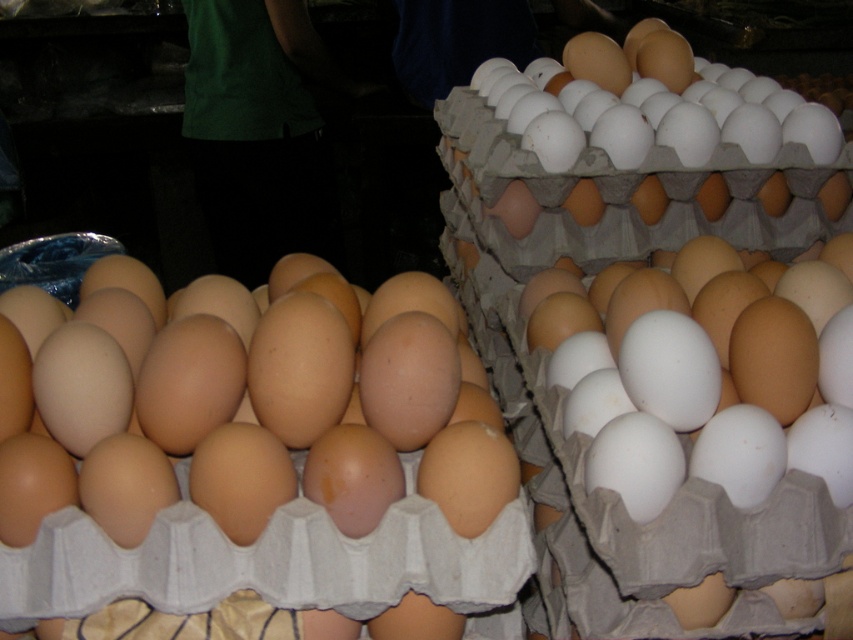
You are a customer at an egg display. You need to reach the brown matte egg at center without disturbing the white matte egg at upper right. Is this possible?

The brown matte egg at center is positioned under the white matte egg at upper right, so you can reach the brown matte egg at center without moving the white matte egg at upper right.

In the scene shown: You are a delivery person who needs to place a new egg carton between the brown matte egg at center and the white matte egg at center. The carton is 12 inches long. Can you fit it between them without moving the existing eggs?

The distance between the brown matte egg at center and the white matte egg at center is 12.73 inches. Since the carton is 12 inches long, it can fit between them as there is enough space.

You are a customer at the store looking for an egg. You see the brown matte egg at center and the white matte egg at upper right. Which egg is positioned to the left of the other?

The brown matte egg at center is to the left of the white matte egg at upper right.